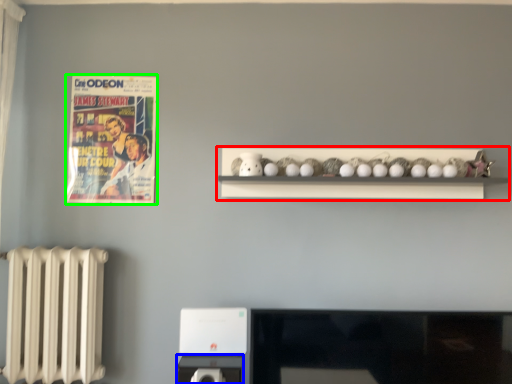
Question: Based on their relative distances, which object is farther from shelf (highlighted by a red box)? Choose from appliance (highlighted by a blue box) and comic book (highlighted by a green box).

Choices:
 (A) appliance
 (B) comic book

Answer: (A)